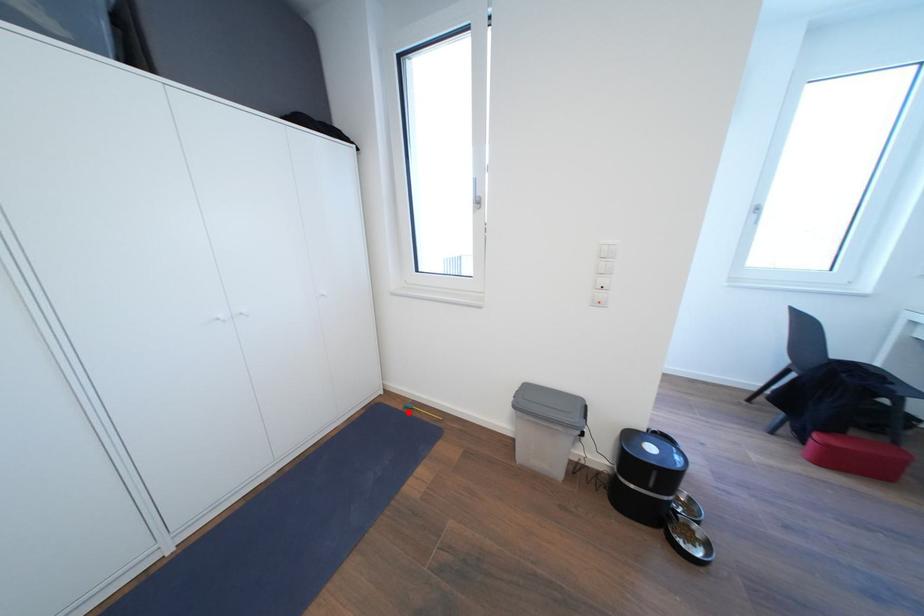
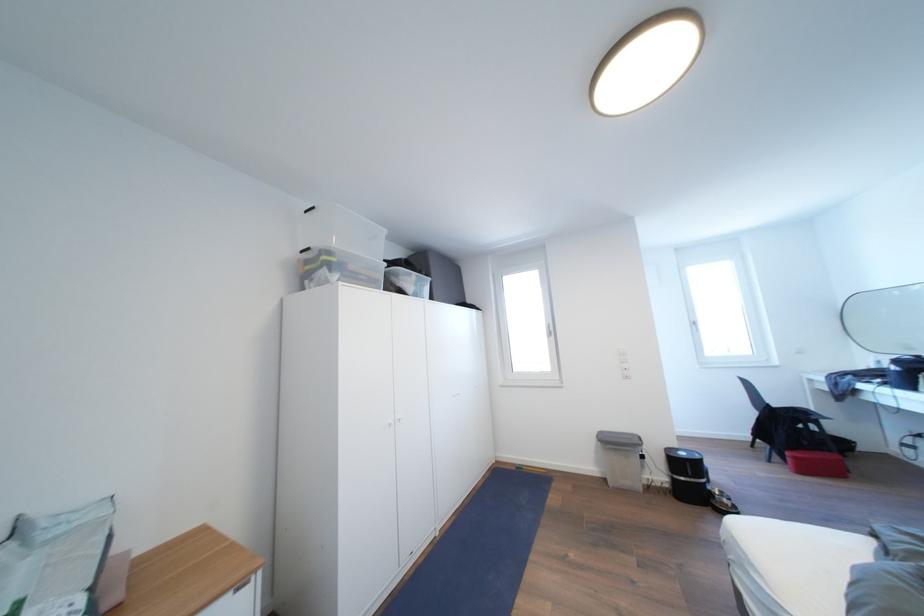
Locate, in the second image, the point that corresponds to the highlighted location in the first image.

(521, 472)